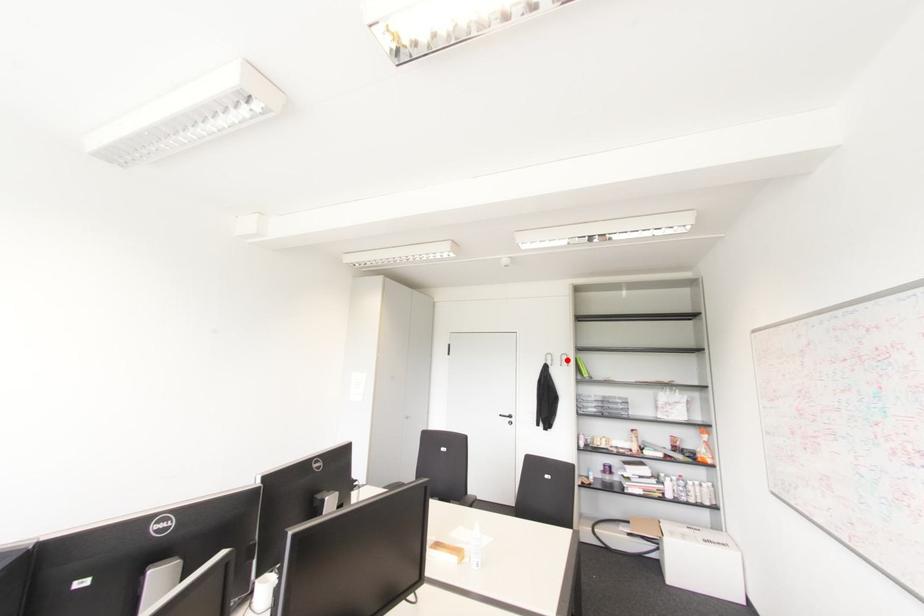
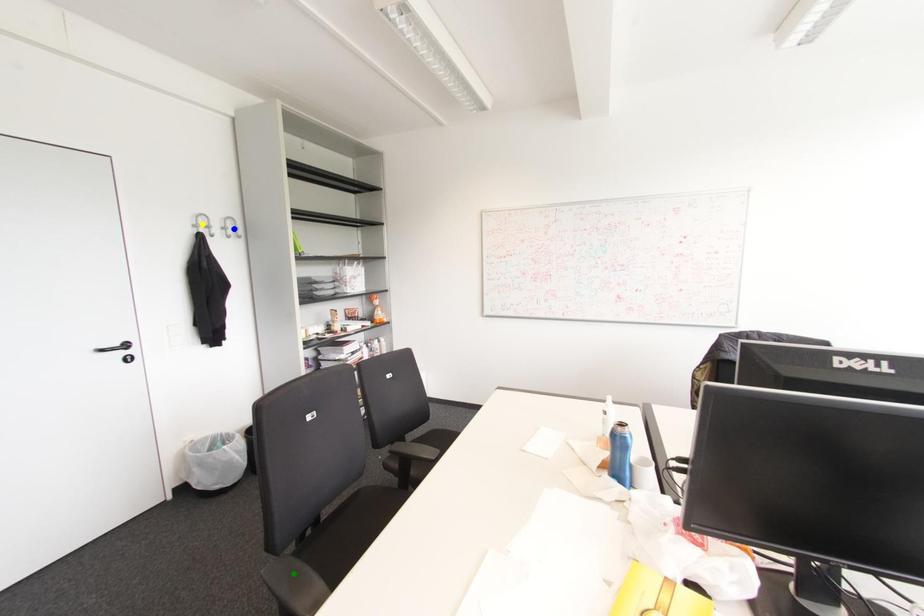
Question: I am providing you with two images of the same scene from different viewpoints. A red point is marked on the first image. You are given multiple points on the second image. Which spot in image 2 lines up with the point in image 1?

Choices:
 (A) green point
 (B) blue point
 (C) yellow point

Answer: (B)